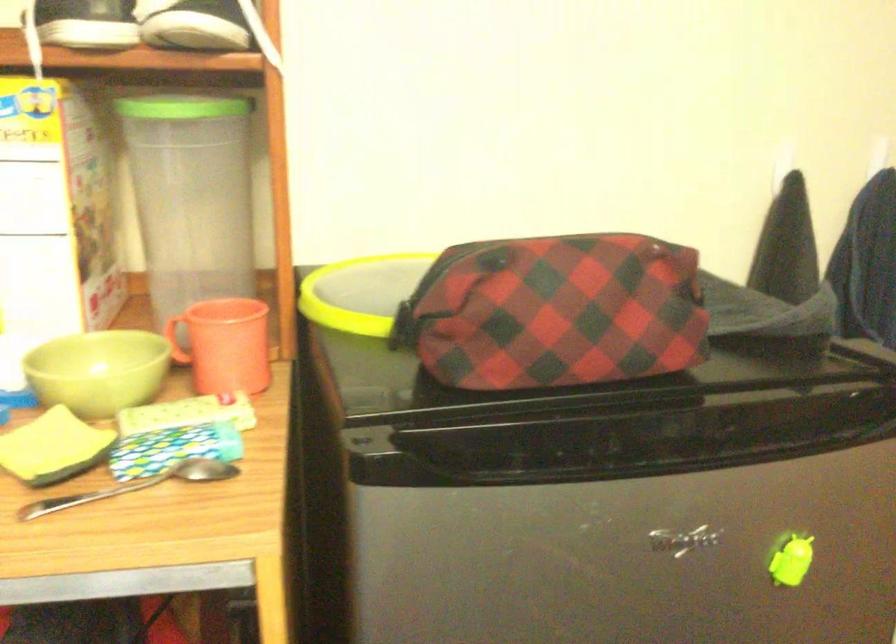
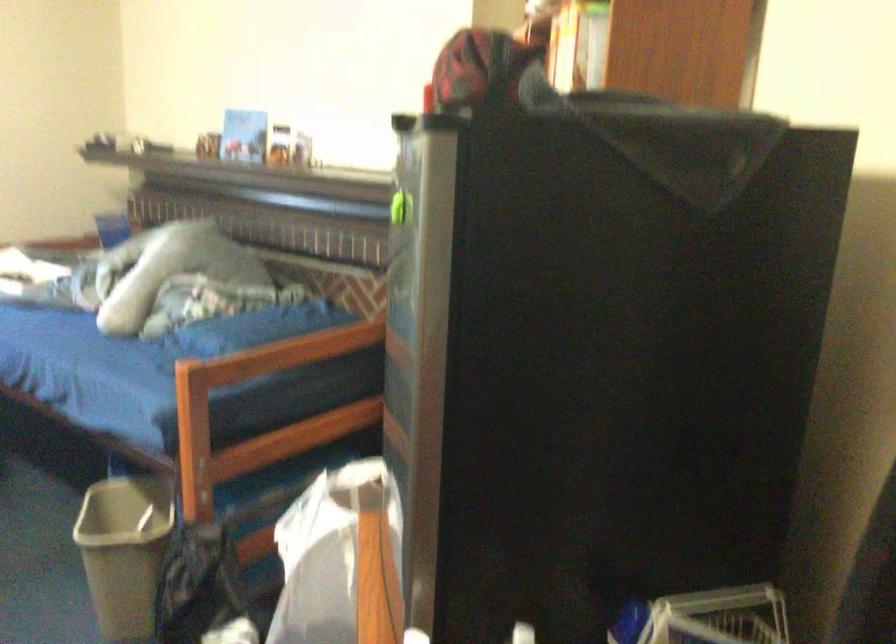
Question: I am providing you with two images of the same scene from different viewpoints. After the viewpoint changes to image2, which objects are now occluded?

Choices:
 (A) white wire basket
 (B) silver lantern handle
 (C) grey trash can
 (D) metal spoon

Answer: (D)